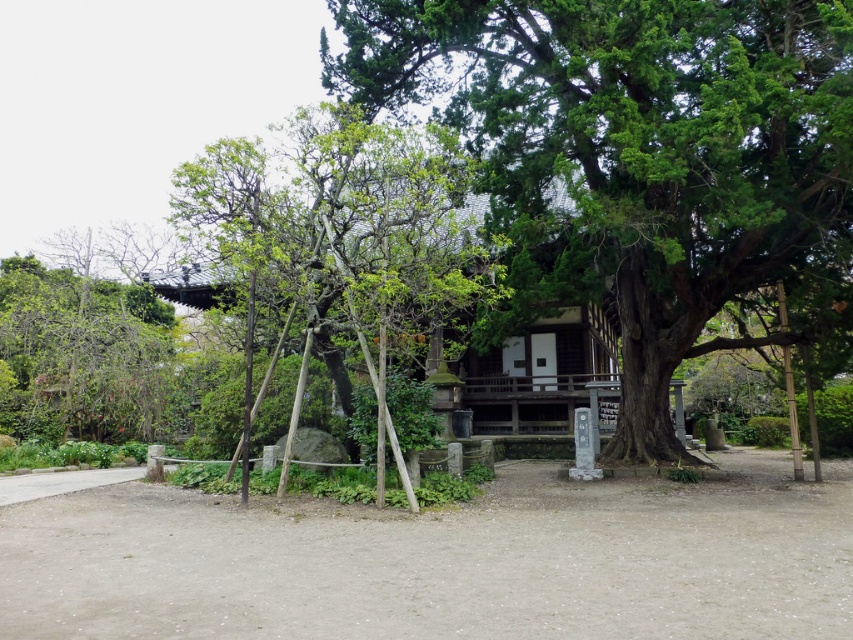
Which is more to the left, green leafy tree at center or green leafy tree at left?

green leafy tree at left

Does green leafy tree at center have a larger size compared to green leafy tree at left?

Indeed, green leafy tree at center has a larger size compared to green leafy tree at left.

Find the location of a particular element. Image resolution: width=853 pixels, height=640 pixels. green leafy tree at center is located at coordinates (341, 220).

Does point (844, 93) come closer to viewer compared to point (314, 202)?

Yes, it is.

How distant is green textured tree at center from green leafy tree at center?

The distance of green textured tree at center from green leafy tree at center is 2.84 meters.

Identify the location of green textured tree at center. (630, 150).

Can you confirm if green textured tree at center is shorter than green leafy tree at left?

Incorrect, green textured tree at center's height does not fall short of green leafy tree at left's.

Does green textured tree at center have a greater height compared to green leafy tree at left?

Indeed, green textured tree at center has a greater height compared to green leafy tree at left.

Which is in front, point (845, 56) or point (78, 372)?

Point (845, 56) is more forward.

You are a GUI agent. You are given a task and a screenshot of the screen. Output one action in this format:
    pyautogui.click(x=<x>, y=<y>)
    Task: Click on the green textured tree at center
    The height and width of the screenshot is (640, 853).
    Given the screenshot: What is the action you would take?
    pyautogui.click(x=630, y=150)